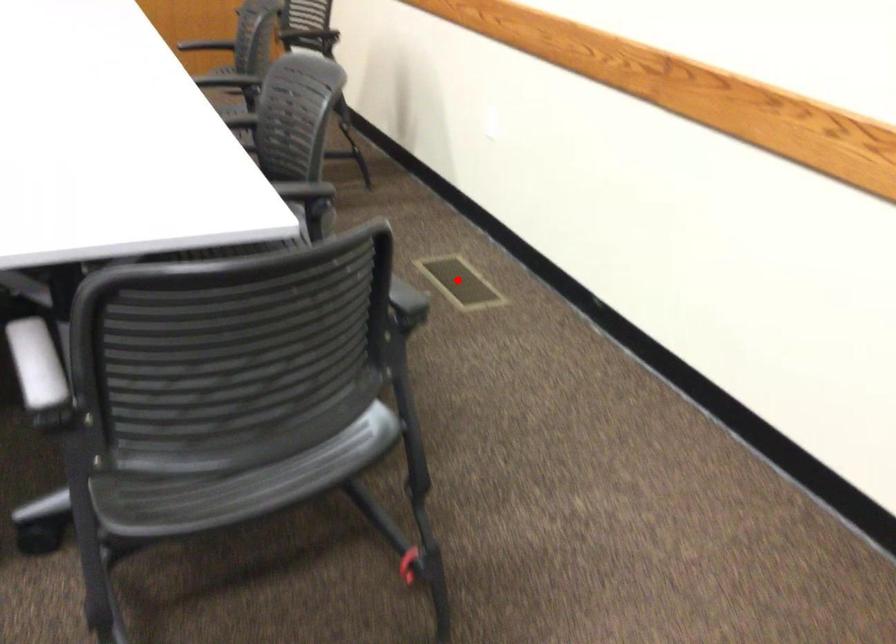
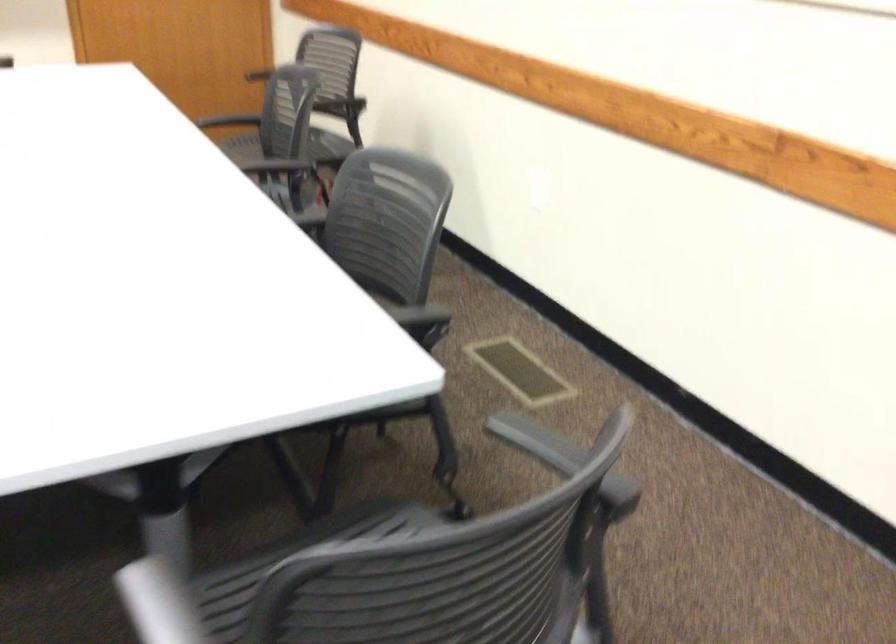
Where in the second image is the point corresponding to the highlighted location from the first image?

(520, 370)